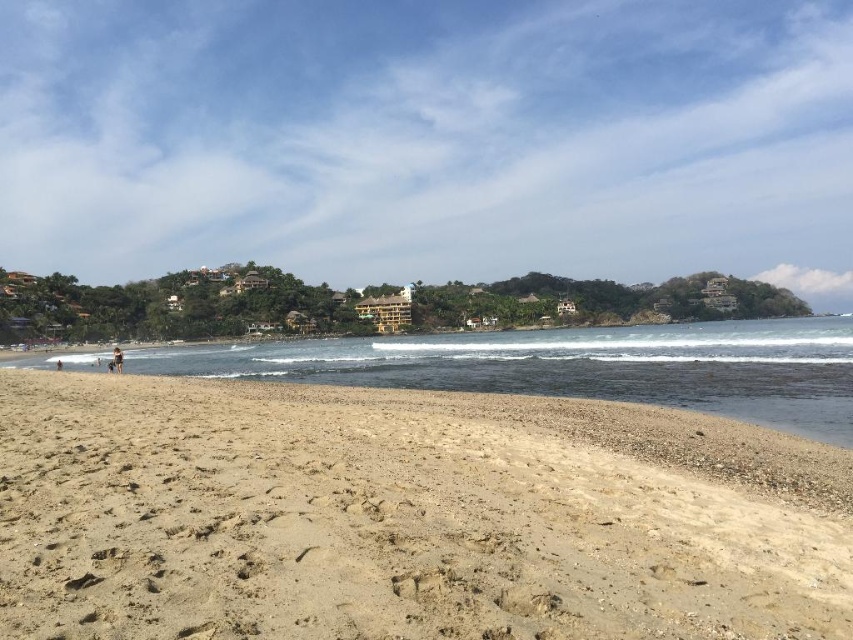
You are standing on the light brown sandy beach at lower left and want to walk towards the tan skin person at lower left. Which direction should you move to reach them?

The light brown sandy beach at lower left is in front of the tan skin person at lower left, so you should move backward to reach them.